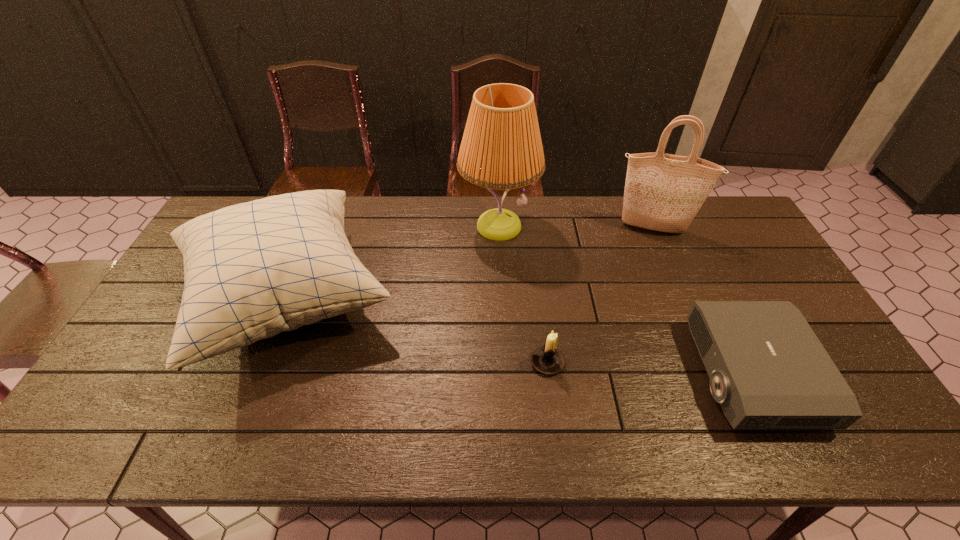
What are the coordinates of `free space that satisfies the following two spatial constraints: 1. on the back side of the third tallest object; 2. on the right side of the shopping bag` in the screenshot? It's located at (317, 228).